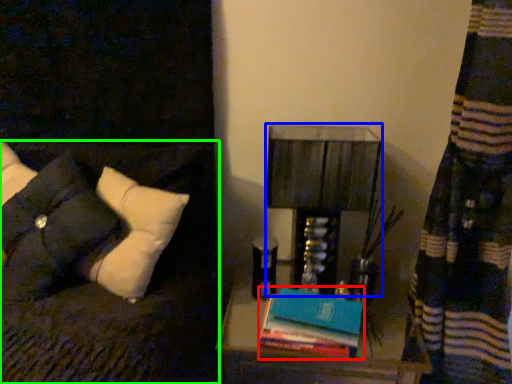
Question: Based on their relative distances, which object is farther from book (highlighted by a red box)? Choose from table lamp (highlighted by a blue box) and furniture (highlighted by a green box).

Choices:
 (A) table lamp
 (B) furniture

Answer: (B)